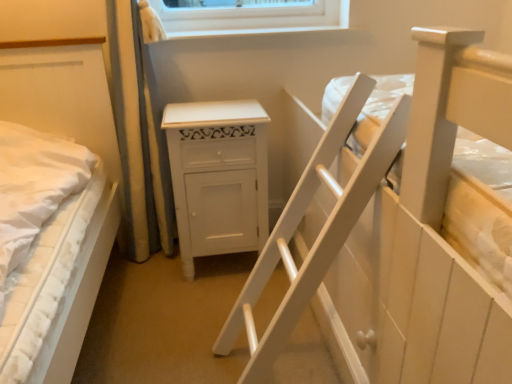
This screenshot has width=512, height=384. What are the coordinates of `white textured mattress at left, arranged as the 1th bed when viewed from the left` in the screenshot? It's located at (81, 144).

Where is `the chest of drawers located behind the white textured mattress at left, the 2th bed in the right-to-left sequence`? This screenshot has height=384, width=512. the chest of drawers located behind the white textured mattress at left, the 2th bed in the right-to-left sequence is located at coordinates (218, 176).

Is white textured mattress at left, the 2th bed in the right-to-left sequence, wider than white painted wood cabinet at center?

Correct, the width of white textured mattress at left, the 2th bed in the right-to-left sequence, exceeds that of white painted wood cabinet at center.

Which is behind, point (35, 56) or point (187, 155)?

The point (35, 56) is behind.

Is white textured mattress at left, the 2th bed in the right-to-left sequence, to the left or to the right of white wooden bed at upper right, the 2th bed viewed from the left, in the image?

white textured mattress at left, the 2th bed in the right-to-left sequence, is to the left of white wooden bed at upper right, the 2th bed viewed from the left.

Considering the relative sizes of white textured mattress at left, the 2th bed in the right-to-left sequence, and white wooden bed at upper right, the 1th bed viewed from the right, in the image provided, is white textured mattress at left, the 2th bed in the right-to-left sequence, shorter than white wooden bed at upper right, the 1th bed viewed from the right,?

Yes, white textured mattress at left, the 2th bed in the right-to-left sequence, is shorter than white wooden bed at upper right, the 1th bed viewed from the right.

Could you tell me if white textured mattress at left, the 2th bed in the right-to-left sequence, is turned towards white wooden bed at upper right, the 2th bed viewed from the left?

No, white textured mattress at left, the 2th bed in the right-to-left sequence, is not turned towards white wooden bed at upper right, the 2th bed viewed from the left.

Can we say white painted wood cabinet at center lies outside white textured mattress at left, the 2th bed in the right-to-left sequence?

That's correct, white painted wood cabinet at center is outside of white textured mattress at left, the 2th bed in the right-to-left sequence.

Considering the sizes of white painted wood cabinet at center and white textured mattress at left, arranged as the 1th bed when viewed from the left, in the image, is white painted wood cabinet at center bigger or smaller than white textured mattress at left, arranged as the 1th bed when viewed from the left,?

In the image, white painted wood cabinet at center appears to be smaller than white textured mattress at left, arranged as the 1th bed when viewed from the left.

Can you see white painted wood cabinet at center touching white textured mattress at left, arranged as the 1th bed when viewed from the left?

No, white painted wood cabinet at center is not with white textured mattress at left, arranged as the 1th bed when viewed from the left.

Between white painted wood cabinet at center and white textured mattress at left, arranged as the 1th bed when viewed from the left, which one has more height?

white textured mattress at left, arranged as the 1th bed when viewed from the left, is taller.

Considering the positions of objects white wooden bed at upper right, the 1th bed viewed from the right, and white textured mattress at left, the 2th bed in the right-to-left sequence, in the image provided, who is more to the right, white wooden bed at upper right, the 1th bed viewed from the right, or white textured mattress at left, the 2th bed in the right-to-left sequence,?

white wooden bed at upper right, the 1th bed viewed from the right, is more to the right.

Is white wooden bed at upper right, the 1th bed viewed from the right, spatially inside white textured mattress at left, the 2th bed in the right-to-left sequence, or outside of it?

white wooden bed at upper right, the 1th bed viewed from the right, is outside white textured mattress at left, the 2th bed in the right-to-left sequence.

Considering the positions of point (510, 138) and point (39, 108), is point (510, 138) closer or farther from the camera than point (39, 108)?

Point (510, 138) is positioned closer to the camera compared to point (39, 108).

Can you confirm if white wooden bed at upper right, the 2th bed viewed from the left, is bigger than white textured mattress at left, arranged as the 1th bed when viewed from the left?

Indeed, white wooden bed at upper right, the 2th bed viewed from the left, has a larger size compared to white textured mattress at left, arranged as the 1th bed when viewed from the left.

From the image's perspective, is white wooden bed at upper right, the 1th bed viewed from the right, on top of white painted wood cabinet at center?

Yes, from the image's perspective, white wooden bed at upper right, the 1th bed viewed from the right, is on top of white painted wood cabinet at center.

Which of these two, white wooden bed at upper right, the 2th bed viewed from the left, or white painted wood cabinet at center, is smaller?

white painted wood cabinet at center is smaller.

From a real-world perspective, which object stands above the other?

In real-world perspective, white wooden bed at upper right, the 2th bed viewed from the left, is above.

Is white painted wood cabinet at center far from white wooden bed at upper right, the 2th bed viewed from the left?

They are positioned close to each other.

Between white painted wood cabinet at center and white wooden bed at upper right, the 2th bed viewed from the left, which one is positioned in front?

Positioned in front is white wooden bed at upper right, the 2th bed viewed from the left.

Considering the positions of points (202, 216) and (373, 222), is point (202, 216) farther from camera compared to point (373, 222)?

Yes, it is behind point (373, 222).

How different are the orientations of white painted wood cabinet at center and white wooden bed at upper right, the 1th bed viewed from the right, in degrees?

white painted wood cabinet at center and white wooden bed at upper right, the 1th bed viewed from the right, are facing 179 degrees away from each other.

Find the location of a particular element. The image size is (512, 384). bed on the left of white painted wood cabinet at center is located at coordinates (81, 144).

Find the location of a particular element. The height and width of the screenshot is (384, 512). bed located below the white wooden bed at upper right, the 1th bed viewed from the right (from the image's perspective) is located at coordinates tap(81, 144).

Considering their positions, is white painted wood cabinet at center positioned further to white textured mattress at left, arranged as the 1th bed when viewed from the left, than white wooden bed at upper right, the 2th bed viewed from the left?

Among the two, white wooden bed at upper right, the 2th bed viewed from the left, is located further to white textured mattress at left, arranged as the 1th bed when viewed from the left.

From the image, which object appears to be farther from white textured mattress at left, the 2th bed in the right-to-left sequence, white wooden bed at upper right, the 2th bed viewed from the left, or white painted wood cabinet at center?

white wooden bed at upper right, the 2th bed viewed from the left, is positioned further to the anchor white textured mattress at left, the 2th bed in the right-to-left sequence.

Based on their spatial positions, is white textured mattress at left, the 2th bed in the right-to-left sequence, or white wooden bed at upper right, the 2th bed viewed from the left, further from white painted wood cabinet at center?

white wooden bed at upper right, the 2th bed viewed from the left, lies further to white painted wood cabinet at center than the other object.

When comparing their distances from white wooden bed at upper right, the 2th bed viewed from the left, does white textured mattress at left, the 2th bed in the right-to-left sequence, or white painted wood cabinet at center seem closer?

Among the two, white painted wood cabinet at center is located nearer to white wooden bed at upper right, the 2th bed viewed from the left.

Looking at the image, which one is located closer to white painted wood cabinet at center, white wooden bed at upper right, the 1th bed viewed from the right, or white textured mattress at left, the 2th bed in the right-to-left sequence?

The object closer to white painted wood cabinet at center is white textured mattress at left, the 2th bed in the right-to-left sequence.

Based on their spatial positions, is white painted wood cabinet at center or white textured mattress at left, arranged as the 1th bed when viewed from the left, further from white wooden bed at upper right, the 2th bed viewed from the left?

Based on the image, white textured mattress at left, arranged as the 1th bed when viewed from the left, appears to be further to white wooden bed at upper right, the 2th bed viewed from the left.

What are the coordinates of `chest of drawers between white textured mattress at left, arranged as the 1th bed when viewed from the left, and white wooden bed at upper right, the 1th bed viewed from the right` in the screenshot? It's located at pos(218,176).